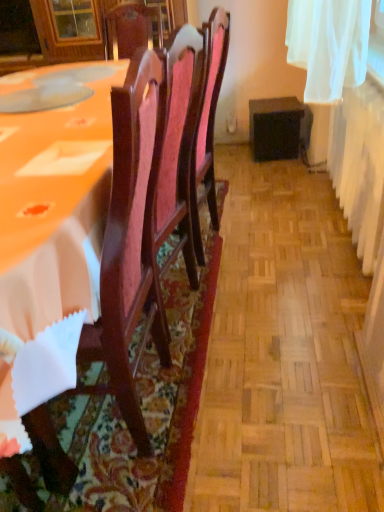
In order to click on matte wood chair at center in this screenshot , I will do `click(126, 424)`.

What do you see at coordinates (126, 424) in the screenshot?
I see `matte wood chair at center` at bounding box center [126, 424].

You are a GUI agent. You are given a task and a screenshot of the screen. Output one action in this format:
    pyautogui.click(x=<x>, y=<y>)
    Task: Click on the matte wood chair at center
    Image resolution: width=384 pixels, height=512 pixels.
    Given the screenshot: What is the action you would take?
    (126, 424)